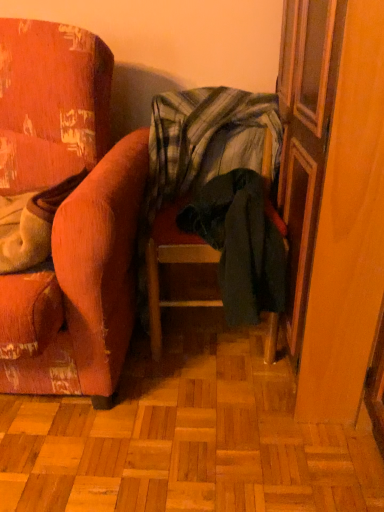
This screenshot has height=512, width=384. Describe the element at coordinates (68, 213) in the screenshot. I see `velvet orange armchair at left, acting as the 1th chair starting from the left` at that location.

At what (x,y) coordinates should I click in order to perform the action: click on velvet orange armchair at left, acting as the 1th chair starting from the left. Please return your answer as a coordinate pair (x, y). The image size is (384, 512). Looking at the image, I should click on (68, 213).

Describe the element at coordinates (206, 139) in the screenshot. Image resolution: width=384 pixels, height=512 pixels. I see `plaid fabric blanket at center` at that location.

Describe the element at coordinates (332, 195) in the screenshot. Image resolution: width=384 pixels, height=512 pixels. I see `wooden screen door at right` at that location.

This screenshot has width=384, height=512. I want to click on velvet orange armchair at left, which is counted as the 2th chair, starting from the right, so click(68, 213).

Based on the photo, can you confirm if wooden screen door at right is wider than dark green fabric chair at center, the 1th chair in the right-to-left sequence?

Indeed, wooden screen door at right has a greater width compared to dark green fabric chair at center, the 1th chair in the right-to-left sequence.

Is wooden screen door at right spatially inside dark green fabric chair at center, the 1th chair in the right-to-left sequence, or outside of it?

wooden screen door at right is spatially situated outside dark green fabric chair at center, the 1th chair in the right-to-left sequence.

Is wooden screen door at right beside dark green fabric chair at center, the second chair in the left-to-right sequence?

No, wooden screen door at right is not in contact with dark green fabric chair at center, the second chair in the left-to-right sequence.

How much distance is there between dark green fabric chair at center, the 1th chair in the right-to-left sequence, and wooden screen door at right?

dark green fabric chair at center, the 1th chair in the right-to-left sequence, is 15.33 inches away from wooden screen door at right.

From the image's perspective, would you say dark green fabric chair at center, the 1th chair in the right-to-left sequence, is positioned over wooden screen door at right?

Incorrect, from the image's perspective, dark green fabric chair at center, the 1th chair in the right-to-left sequence, is lower than wooden screen door at right.

Is dark green fabric chair at center, the 1th chair in the right-to-left sequence, inside the boundaries of wooden screen door at right, or outside?

dark green fabric chair at center, the 1th chair in the right-to-left sequence, is located beyond the bounds of wooden screen door at right.

From the image's perspective, would you say plaid fabric blanket at center is shown under wooden screen door at right?

Actually, plaid fabric blanket at center appears above wooden screen door at right in the image.

Considering the relative positions of plaid fabric blanket at center and wooden screen door at right in the image provided, is plaid fabric blanket at center to the left of wooden screen door at right from the viewer's perspective?

Indeed, plaid fabric blanket at center is positioned on the left side of wooden screen door at right.

Considering the positions of points (280, 133) and (343, 157), is point (280, 133) farther from camera compared to point (343, 157)?

That is True.

From the image's perspective, which object appears higher, velvet orange armchair at left, which is counted as the 2th chair, starting from the right, or wooden screen door at right?

velvet orange armchair at left, which is counted as the 2th chair, starting from the right, is shown above in the image.

Is the surface of velvet orange armchair at left, acting as the 1th chair starting from the left, in direct contact with wooden screen door at right?

velvet orange armchair at left, acting as the 1th chair starting from the left, is not next to wooden screen door at right, and they're not touching.

Which object is further away from the camera, velvet orange armchair at left, acting as the 1th chair starting from the left, or wooden screen door at right?

wooden screen door at right is further from the camera.

Which of these two, velvet orange armchair at left, acting as the 1th chair starting from the left, or wooden screen door at right, is wider?

Wider between the two is velvet orange armchair at left, acting as the 1th chair starting from the left.

How many degrees apart are the facing directions of wooden screen door at right and plaid fabric blanket at center?

The angular difference between wooden screen door at right and plaid fabric blanket at center is 90.8 degrees.

Who is bigger, wooden screen door at right or plaid fabric blanket at center?

Bigger between the two is wooden screen door at right.

Which object is further away from the camera taking this photo, wooden screen door at right or plaid fabric blanket at center?

plaid fabric blanket at center.

Is the surface of wooden screen door at right in direct contact with plaid fabric blanket at center?

They are not placed beside each other.

Is dark green fabric chair at center, the second chair in the left-to-right sequence, taller than plaid fabric blanket at center?

A: Yes, dark green fabric chair at center, the second chair in the left-to-right sequence, is taller than plaid fabric blanket at center.

Does dark green fabric chair at center, the 1th chair in the right-to-left sequence, touch plaid fabric blanket at center?

dark green fabric chair at center, the 1th chair in the right-to-left sequence, is not next to plaid fabric blanket at center, and they're not touching.

Is dark green fabric chair at center, the 1th chair in the right-to-left sequence, positioned in front of plaid fabric blanket at center?

Yes, it is.

Is point (204, 263) positioned before point (251, 143)?

Yes, point (204, 263) is in front of point (251, 143).

The height and width of the screenshot is (512, 384). I want to click on blanket located above the velvet orange armchair at left, acting as the 1th chair starting from the left (from the image's perspective), so click(x=206, y=139).

Considering the points (154, 161) and (114, 182), which point is in front, point (154, 161) or point (114, 182)?

Positioned in front is point (114, 182).

Is plaid fabric blanket at center turned away from velvet orange armchair at left, which is counted as the 2th chair, starting from the right?

No.

Can you confirm if plaid fabric blanket at center is smaller than velvet orange armchair at left, acting as the 1th chair starting from the left?

Yes.

This screenshot has height=512, width=384. I want to click on screen door above the dark green fabric chair at center, the 1th chair in the right-to-left sequence (from a real-world perspective), so click(x=332, y=195).

Where is `the 2nd chair positioned below the wooden screen door at right (from a real-world perspective)`? The width and height of the screenshot is (384, 512). the 2nd chair positioned below the wooden screen door at right (from a real-world perspective) is located at coordinates [173, 264].

Looking at the image, which one is located closer to plaid fabric blanket at center, dark green fabric chair at center, the 1th chair in the right-to-left sequence, or wooden screen door at right?

Based on the image, dark green fabric chair at center, the 1th chair in the right-to-left sequence, appears to be nearer to plaid fabric blanket at center.

Estimate the real-world distances between objects in this image. Which object is closer to velvet orange armchair at left, which is counted as the 2th chair, starting from the right, wooden screen door at right or dark green fabric chair at center, the 1th chair in the right-to-left sequence?

The object closer to velvet orange armchair at left, which is counted as the 2th chair, starting from the right, is dark green fabric chair at center, the 1th chair in the right-to-left sequence.

Considering their positions, is plaid fabric blanket at center positioned closer to velvet orange armchair at left, acting as the 1th chair starting from the left, than wooden screen door at right?

plaid fabric blanket at center lies closer to velvet orange armchair at left, acting as the 1th chair starting from the left, than the other object.

Looking at the image, which one is located closer to velvet orange armchair at left, acting as the 1th chair starting from the left, wooden screen door at right or plaid fabric blanket at center?

Based on the image, plaid fabric blanket at center appears to be nearer to velvet orange armchair at left, acting as the 1th chair starting from the left.

Considering their positions, is dark green fabric chair at center, the second chair in the left-to-right sequence, positioned closer to velvet orange armchair at left, acting as the 1th chair starting from the left, than plaid fabric blanket at center?

Based on the image, plaid fabric blanket at center appears to be nearer to velvet orange armchair at left, acting as the 1th chair starting from the left.

From the image, which object appears to be nearer to wooden screen door at right, dark green fabric chair at center, the 1th chair in the right-to-left sequence, or velvet orange armchair at left, acting as the 1th chair starting from the left?

dark green fabric chair at center, the 1th chair in the right-to-left sequence, is closer to wooden screen door at right.

Looking at the image, which one is located further to wooden screen door at right, plaid fabric blanket at center or velvet orange armchair at left, acting as the 1th chair starting from the left?

velvet orange armchair at left, acting as the 1th chair starting from the left, lies further to wooden screen door at right than the other object.

Based on their spatial positions, is plaid fabric blanket at center or dark green fabric chair at center, the 1th chair in the right-to-left sequence, further from velvet orange armchair at left, acting as the 1th chair starting from the left?

Among the two, dark green fabric chair at center, the 1th chair in the right-to-left sequence, is located further to velvet orange armchair at left, acting as the 1th chair starting from the left.

Find the location of `chair between velvet orange armchair at left, which is counted as the 2th chair, starting from the right, and wooden screen door at right, in the horizontal direction`. chair between velvet orange armchair at left, which is counted as the 2th chair, starting from the right, and wooden screen door at right, in the horizontal direction is located at coordinates pos(173,264).

The image size is (384, 512). What are the coordinates of `blanket located between velvet orange armchair at left, which is counted as the 2th chair, starting from the right, and wooden screen door at right in the left-right direction` in the screenshot? It's located at (206, 139).

The width and height of the screenshot is (384, 512). In order to click on chair between plaid fabric blanket at center and wooden screen door at right in this screenshot , I will do `click(173, 264)`.

Locate an element on the screen. The width and height of the screenshot is (384, 512). blanket between velvet orange armchair at left, which is counted as the 2th chair, starting from the right, and dark green fabric chair at center, the second chair in the left-to-right sequence, from left to right is located at coordinates (206, 139).